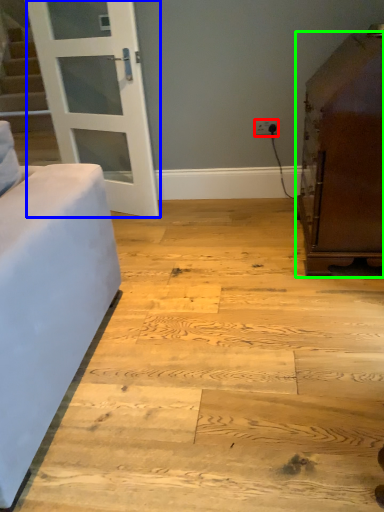
Question: Which object is the farthest from electric outlet (highlighted by a red box)? Choose among these: door (highlighted by a blue box) or furniture (highlighted by a green box).

Choices:
 (A) door
 (B) furniture

Answer: (A)